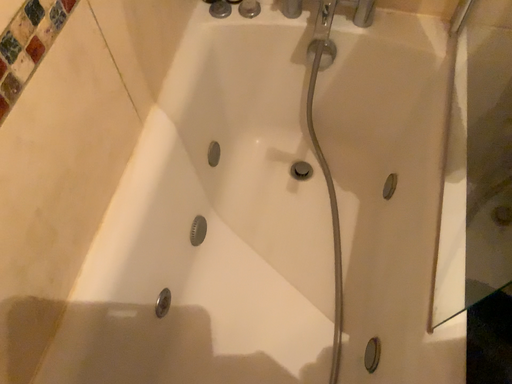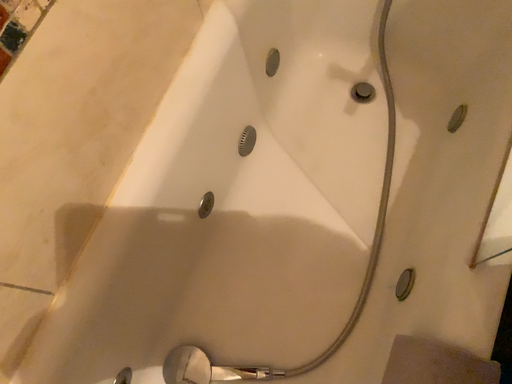
Question: Which way did the camera rotate in the video?

Choices:
 (A) rotated downward
 (B) rotated upward

Answer: (A)